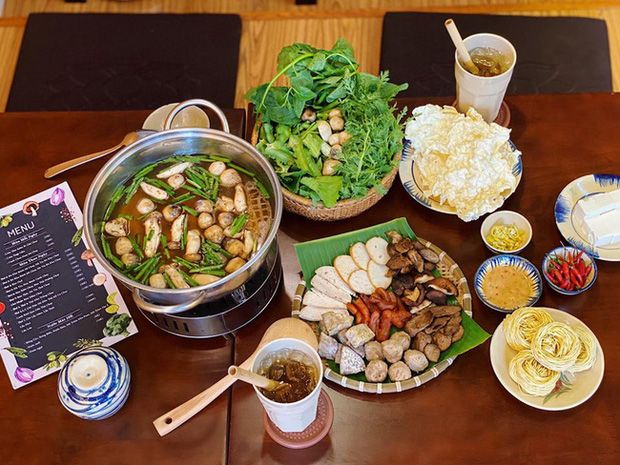
The image size is (620, 465). I want to click on place mats, so click(538, 49), click(129, 92).